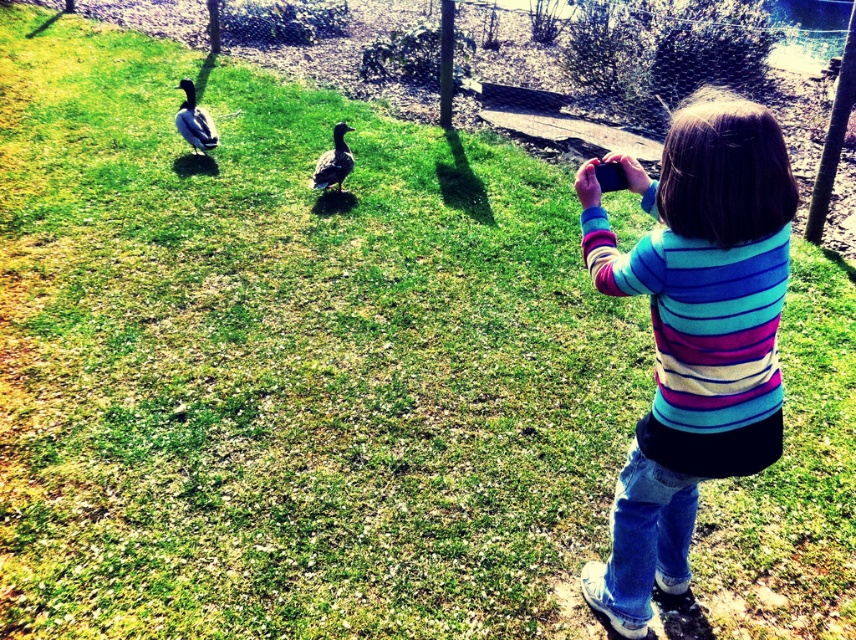
Question: Can you confirm if striped sweater at center is wider than brown feathered duck at left?

Choices:
 (A) no
 (B) yes

Answer: (B)

Question: Is metallic wire mesh at upper center further to the viewer compared to brown matte duck at center?

Choices:
 (A) no
 (B) yes

Answer: (A)

Question: Among these points, which one is farthest from the camera?

Choices:
 (A) (199, 118)
 (B) (608, 618)
 (C) (840, 243)
 (D) (334, 166)

Answer: (A)

Question: Estimate the real-world distances between objects in this image. Which object is closer to the brown feathered duck at left?

Choices:
 (A) brown matte duck at center
 (B) metallic wire mesh at upper center
 (C) striped sweater at center

Answer: (A)

Question: Which point is farther from the camera taking this photo?

Choices:
 (A) (352, 161)
 (B) (779, 250)
 (C) (415, 115)

Answer: (C)

Question: Does metallic wire mesh at upper center have a smaller size compared to brown feathered duck at left?

Choices:
 (A) no
 (B) yes

Answer: (A)